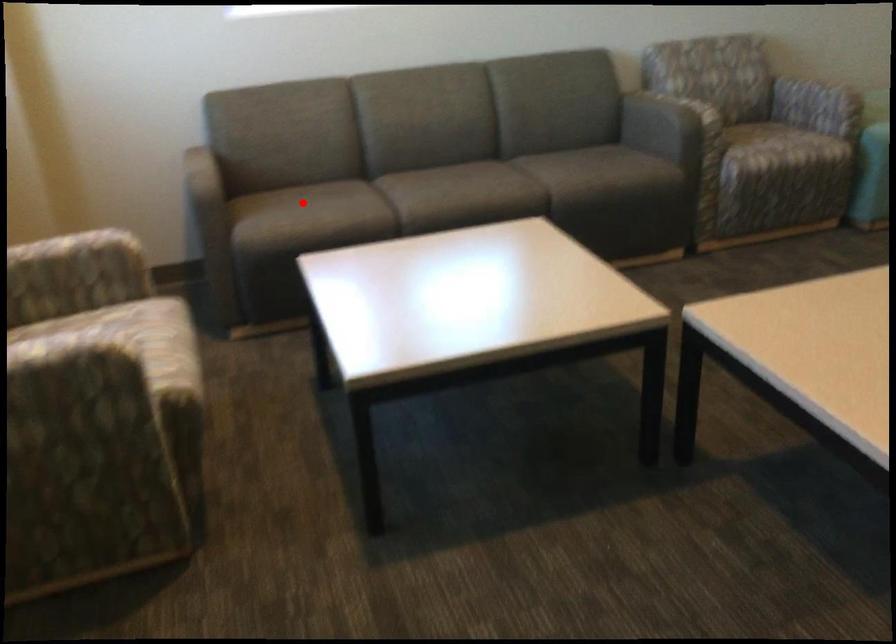
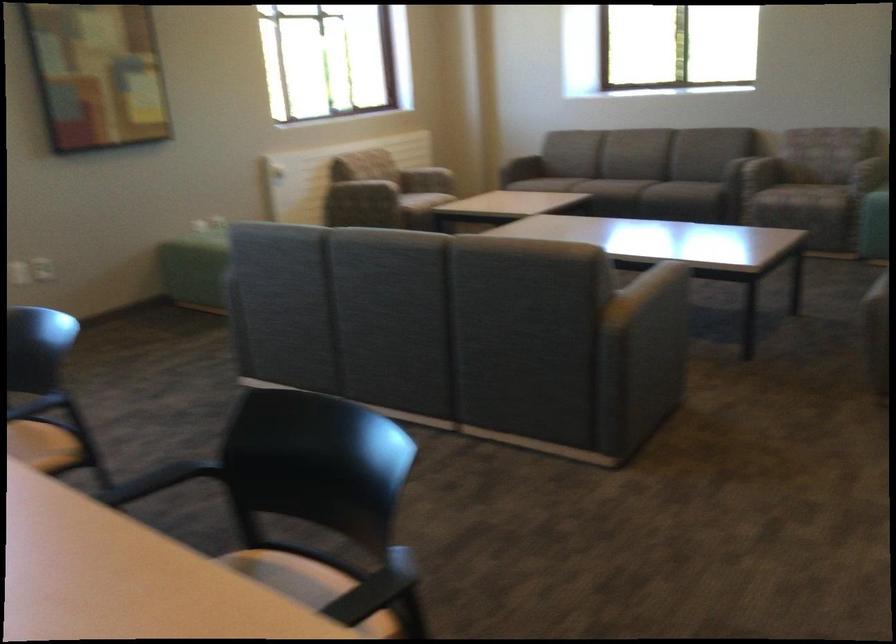
Find the pixel in the second image that matches the highlighted location in the first image.

(522, 167)